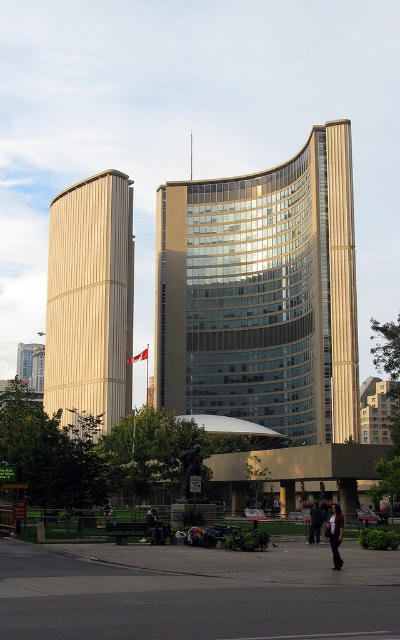
Question: Estimate the real-world distances between objects in this image. Which object is closer to the black leather jacket at lower center?

Choices:
 (A) matte gold tower at left
 (B) dark blue jeans at lower center
 (C) dark gray fabric pants at lower center

Answer: (B)

Question: Which of these objects is positioned closest to the dark blue jeans at lower center?

Choices:
 (A) red fabric flag at center
 (B) black leather jacket at lower center

Answer: (B)

Question: Does dark blue jeans at lower center appear on the right side of black leather jacket at lower center?

Choices:
 (A) yes
 (B) no

Answer: (B)

Question: Which of the following is the farthest from the observer?

Choices:
 (A) (314, 500)
 (B) (332, 515)

Answer: (A)

Question: Is dark gray fabric pants at lower center to the right of black leather jacket at lower center from the viewer's perspective?

Choices:
 (A) no
 (B) yes

Answer: (A)

Question: Is matte gold tower at left bigger than dark blue jeans at lower center?

Choices:
 (A) yes
 (B) no

Answer: (A)